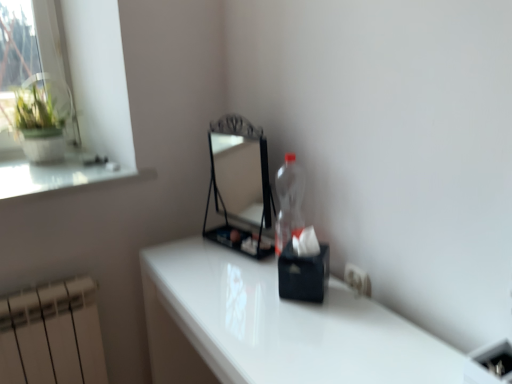
Question: From a real-world perspective, is metallic black mirror at center above or below white glossy table at center?

Choices:
 (A) above
 (B) below

Answer: (A)

Question: Based on their sizes in the image, would you say metallic black mirror at center is bigger or smaller than white glossy table at center?

Choices:
 (A) small
 (B) big

Answer: (A)

Question: Considering the real-world distances, which object is farthest from the white plastic electric outlet at lower right?

Choices:
 (A) metallic black mirror at center
 (B) white glossy table at center

Answer: (A)

Question: Which of these objects is positioned farthest from the white glossy table at center?

Choices:
 (A) metallic black mirror at center
 (B) white plastic electric outlet at lower right

Answer: (A)